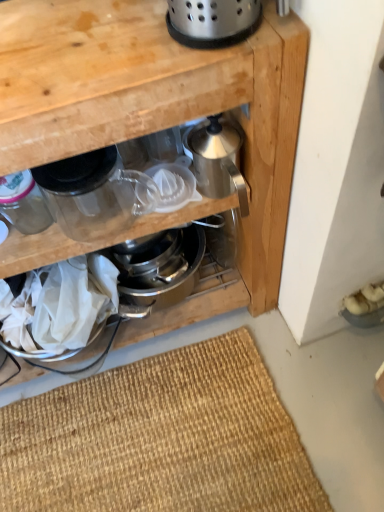
Locate an element on the screen. This screenshot has height=512, width=384. free space above brown woven mat at lower center (from a real-world perspective) is located at coordinates (228, 417).